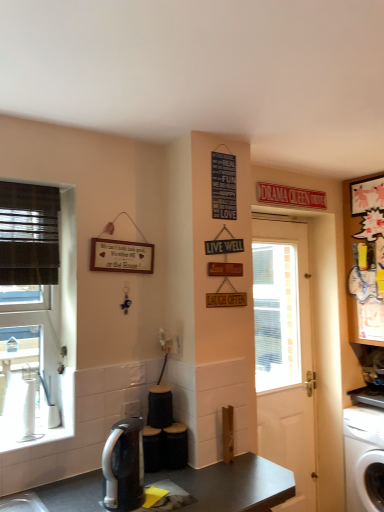
The width and height of the screenshot is (384, 512). Identify the location of vacant area located to the right-hand side of sleek silver coffee maker at lower center. (186, 494).